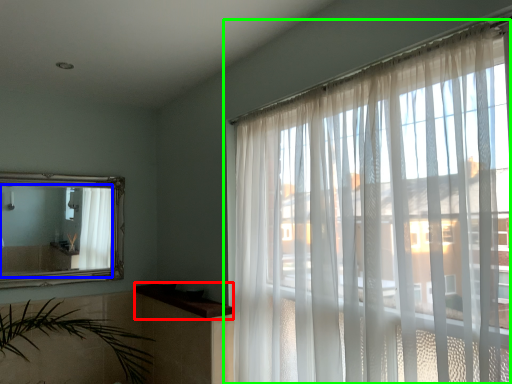
Question: Considering the real-world distances, which object is closest to window sill (highlighted by a red box)? mirror (highlighted by a blue box) or window (highlighted by a green box).

Choices:
 (A) mirror
 (B) window

Answer: (A)